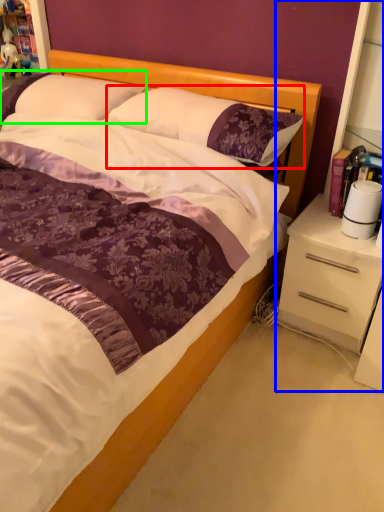
Question: Considering the real-world distances, which object is closest to pillow (highlighted by a red box)? dresser (highlighted by a blue box) or pillow (highlighted by a green box).

Choices:
 (A) dresser
 (B) pillow

Answer: (B)